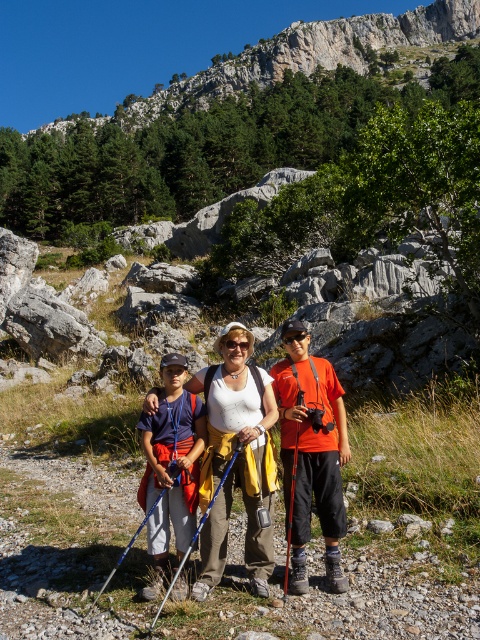
You are a photographer trying to capture a group photo of the matte white tank top at center and the blue fabric shirt at center. Since the two are standing side by side, which clothing item would you adjust in your composition to ensure both are fully visible in the frame?

The matte white tank top at center is shorter than the blue fabric shirt at center. To ensure both are fully visible, you should lower the camera angle slightly to include the full height of the matte white tank top at center without cropping the top of the blue fabric shirt at center.

You are planning to take a photo of the rocky cliff at upper center and the orange matte shirt at center. The camera you are using has a maximum focus range of 200 meters. Will you be able to capture both subjects in focus at the same time?

The rocky cliff at upper center and orange matte shirt at center are 240.32 meters apart. Since the camera can only focus up to 200 meters, it won your be able to capture both in focus simultaneously.

You are a photographer planning to take a group photo of the matte white tank top at center and the blue fabric shirt at center. The camera you are using has a maximum focus range of 6 feet. Can you capture both subjects in focus without moving either of them?

The matte white tank top at center is 7.26 feet from the blue fabric shirt at center, which exceeds the camera maximum focus range of 6 feet. Therefore, you cannot capture both subjects in focus without moving them.